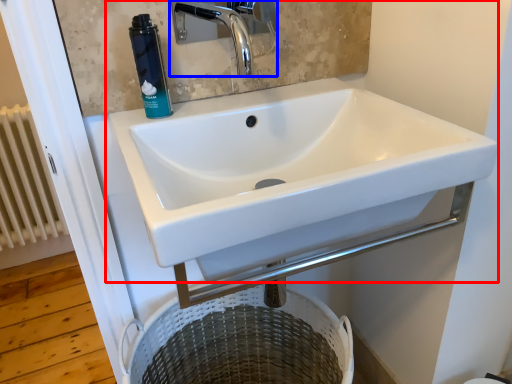
Question: Which object is further to the camera taking this photo, sink (highlighted by a red box) or tap (highlighted by a blue box)?

Choices:
 (A) sink
 (B) tap

Answer: (B)